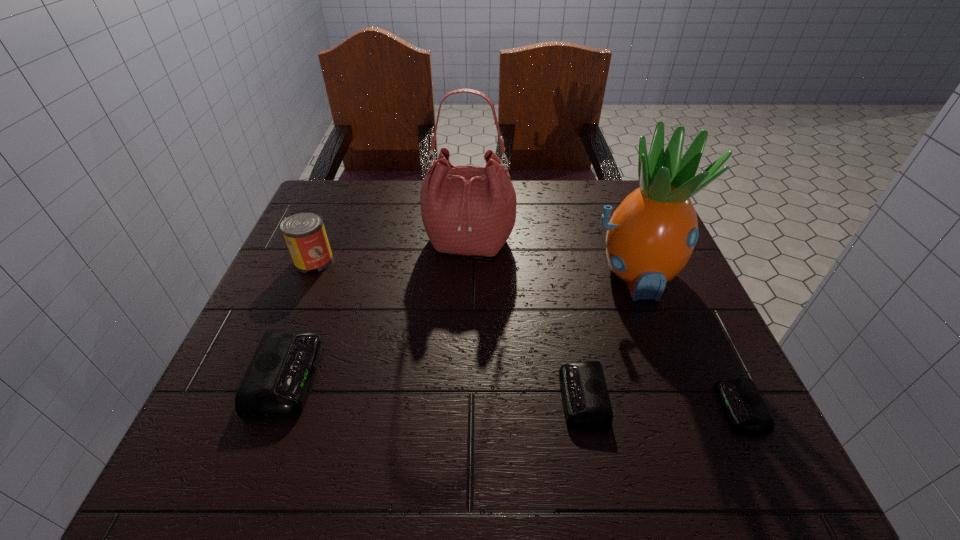
Identify the location of alarm clock that is positioned at the left edge. (276, 384).

Identify the location of can that is positioned at the left edge. (304, 232).

At what (x,y) coordinates should I click in order to perform the action: click on alarm clock that is positioned at the right edge. Please return your answer as a coordinate pair (x, y). Looking at the image, I should click on point(742,402).

You are a GUI agent. You are given a task and a screenshot of the screen. Output one action in this format:
    pyautogui.click(x=<x>, y=<y>)
    Task: Click on the pineapple at the right edge
    
    Given the screenshot: What is the action you would take?
    pyautogui.click(x=650, y=237)

You are a GUI agent. You are given a task and a screenshot of the screen. Output one action in this format:
    pyautogui.click(x=<x>, y=<y>)
    Task: Click on the object that is at the near left corner
    The width and height of the screenshot is (960, 540).
    Given the screenshot: What is the action you would take?
    pyautogui.click(x=276, y=384)

Where is `object at the near right corner`? This screenshot has height=540, width=960. object at the near right corner is located at coordinates (742, 402).

The height and width of the screenshot is (540, 960). What are the coordinates of `vacant area at the far edge` in the screenshot? It's located at (372, 219).

In the image, there is a desktop. Identify the location of free space at the near edge. The height and width of the screenshot is (540, 960). (642, 409).

Find the location of `free space at the left edge`. free space at the left edge is located at coordinates (276, 282).

Locate an element on the screen. Image resolution: width=960 pixels, height=540 pixels. free region at the right edge of the desktop is located at coordinates (629, 299).